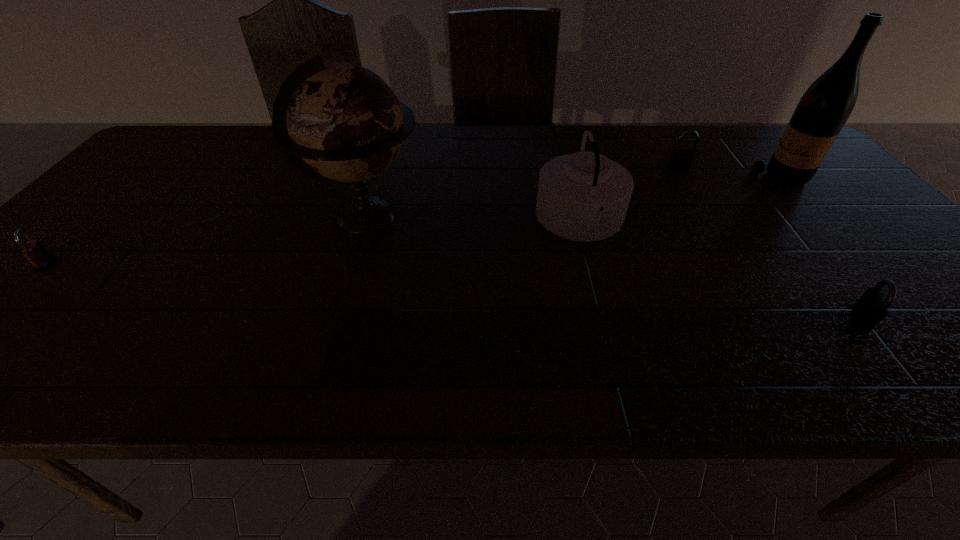
The height and width of the screenshot is (540, 960). What are the coordinates of `vacant space at the far edge of the desktop` in the screenshot? It's located at (729, 161).

Where is `free space at the near edge of the desktop`? This screenshot has height=540, width=960. free space at the near edge of the desktop is located at coordinates (791, 354).

Locate an element on the screen. The image size is (960, 540). vacant region at the right edge of the desktop is located at coordinates (834, 224).

Locate an element on the screen. unoccupied area between the nearest object and the leftmost object is located at coordinates (453, 291).

Locate an element on the screen. blank region between the wine bottle and the second padlock from right to left is located at coordinates (731, 175).

At what (x,y) coordinates should I click in order to perform the action: click on free space between the rightmost padlock and the wine bottle. Please return your answer as a coordinate pair (x, y). Looking at the image, I should click on (822, 250).

Locate an element on the screen. Image resolution: width=960 pixels, height=540 pixels. free spot between the kettle and the nearest object is located at coordinates (721, 270).

This screenshot has height=540, width=960. I want to click on empty location between the fifth object from right to left and the third object from left to right, so click(474, 220).

I want to click on unoccupied area between the second farthest padlock and the nearest padlock, so click(453, 291).

Locate an element on the screen. The image size is (960, 540). empty space that is in between the farthest padlock and the globe is located at coordinates (523, 193).